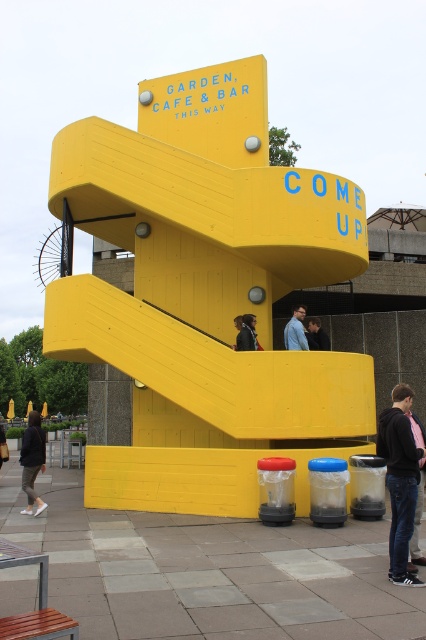
You are a photographer trying to capture both the pink fabric jacket at lower right and the dark blue jacket at center in a single frame. Which jacket should you focus on first to ensure both are in the frame?

The pink fabric jacket at lower right is larger in size than the dark blue jacket at center, so you should focus on the pink fabric jacket at lower right first to ensure both are in the frame.